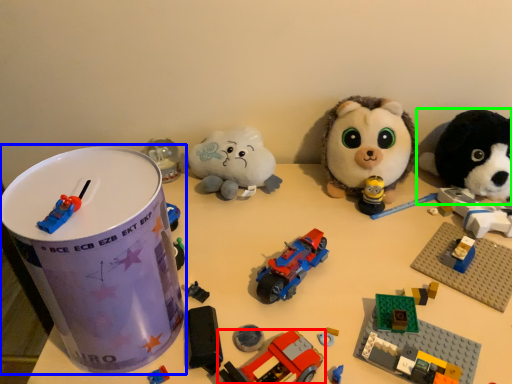
Question: Which object is positioned farthest from toy (highlighted by a red box)? Select from toy (highlighted by a blue box) and toy (highlighted by a green box).

Choices:
 (A) toy
 (B) toy

Answer: (B)